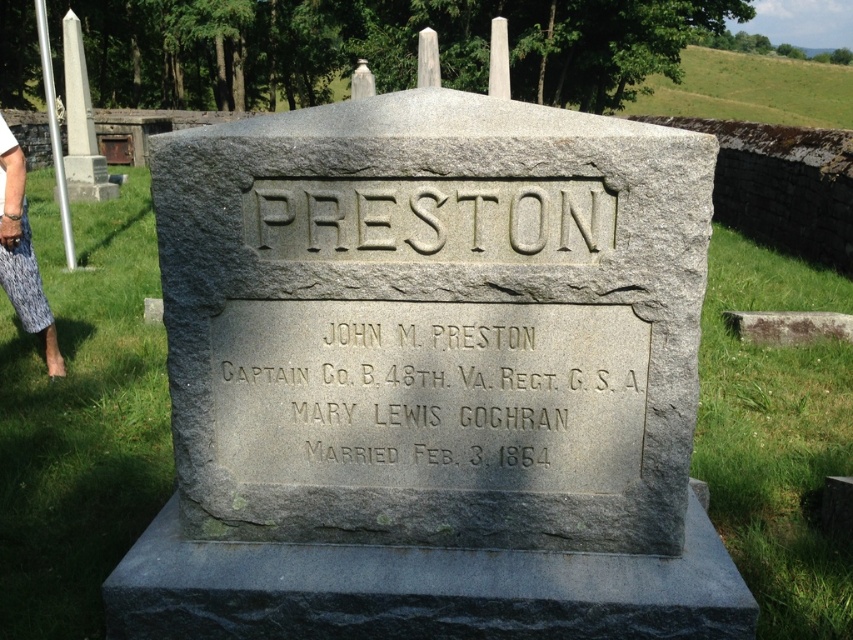
You are a historian examining the gravestone and notice two inscriptions. The first is the gold engraved text at center, and the second is the gray stone engraving at center. Which inscription is more prominent in size?

The gold engraved text at center is larger in size than the gray stone engraving at center, making it more prominent.

What is the significance of the point marked at coordinates (430, 394) on the gravestone?

The point marked at coordinates (430, 394) on the gravestone indicates the location of the gold engraved text at the center, which likely contains important details about John M. Preston such as his military rank and regiment as mentioned in the inscription.